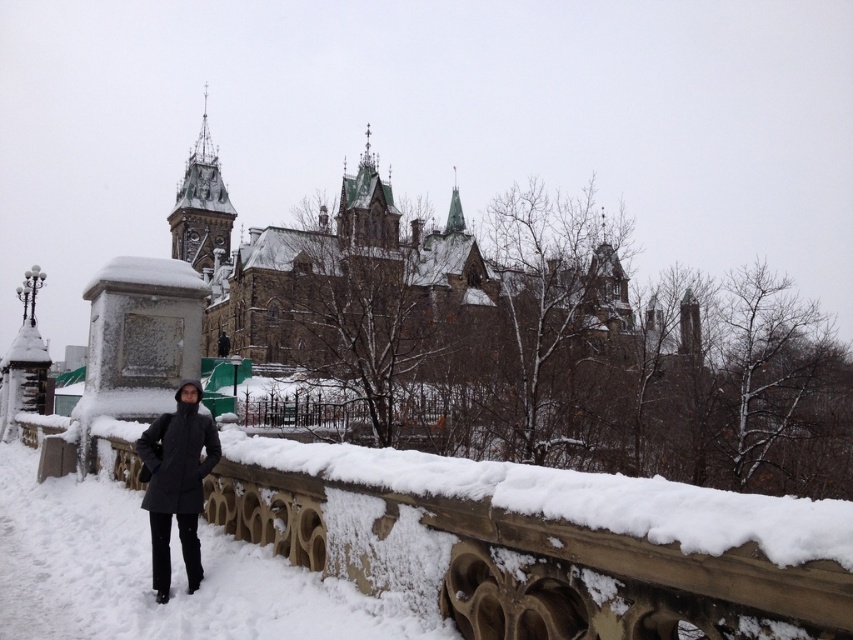
Question: Which point is closer to the camera?

Choices:
 (A) sanded stone balustrade at lower left
 (B) dark gray coat at center

Answer: (A)

Question: Which point is closer to the camera?

Choices:
 (A) (165, 468)
 (B) (451, 605)

Answer: (B)

Question: From the image, what is the correct spatial relationship of sanded stone balustrade at lower left in relation to dark gray coat at center?

Choices:
 (A) right
 (B) left

Answer: (B)

Question: Which point appears farthest from the camera in this image?

Choices:
 (A) (192, 524)
 (B) (265, 504)

Answer: (B)

Question: Can you confirm if sanded stone balustrade at lower left is positioned to the left of dark gray coat at center?

Choices:
 (A) yes
 (B) no

Answer: (A)

Question: Can you confirm if sanded stone balustrade at lower left is positioned above dark gray coat at center?

Choices:
 (A) yes
 (B) no

Answer: (B)